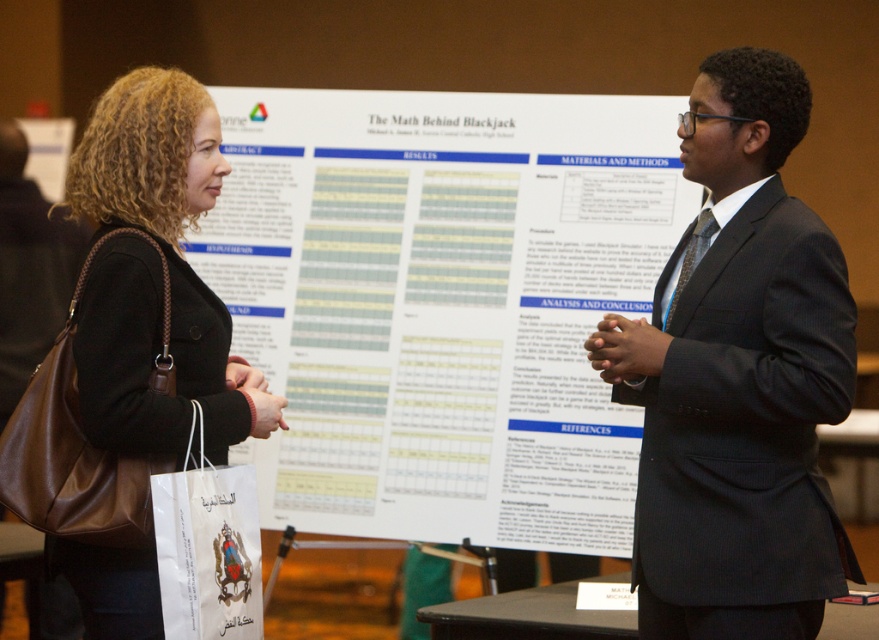
Does white paper poster at center appear on the left side of brown leather bag at left?

No, white paper poster at center is not to the left of brown leather bag at left.

Does white paper poster at center appear under brown leather bag at left?

Indeed, white paper poster at center is positioned under brown leather bag at left.

Measure the distance between white paper poster at center and camera.

white paper poster at center and camera are 3.32 meters apart.

This screenshot has width=879, height=640. In order to click on white paper poster at center in this screenshot , I will do `click(442, 304)`.

Image resolution: width=879 pixels, height=640 pixels. Describe the element at coordinates (442, 304) in the screenshot. I see `white paper poster at center` at that location.

Is point (543, 154) farther from viewer compared to point (194, 394)?

Yes.

Where is `white paper poster at center`? The width and height of the screenshot is (879, 640). white paper poster at center is located at coordinates coord(442,304).

Does black leather bag at left appear on the right side of brown leather bag at left?

Yes, black leather bag at left is to the right of brown leather bag at left.

Between point (190, 369) and point (51, 628), which one is positioned in front?

Positioned in front is point (190, 369).

Is point (150, 273) less distant than point (25, 380)?

Yes, point (150, 273) is closer to viewer.

Locate an element on the screen. This screenshot has width=879, height=640. black leather bag at left is located at coordinates (156, 276).